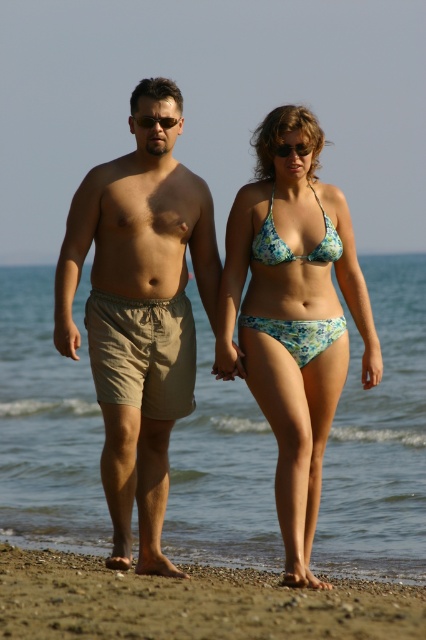
You are a photographer trying to capture a close shot of both the black plastic sunglasses at center and the green plastic sunglasses at center. Your camera has a focus range of 3 feet. Can you capture both in the same photo without moving the camera?

The black plastic sunglasses at center and green plastic sunglasses at center are 3.74 feet apart, which exceeds the camera focus range of 3 feet. Therefore, you cannot capture both in the same photo without moving the camera.

You are a photographer trying to capture both the black plastic sunglasses at center and the green plastic sunglasses at center in a single shot. Which pair of sunglasses will appear closer to you in the photo?

The black plastic sunglasses at center will appear closer to you in the photo because it is positioned further to the viewer than the green plastic sunglasses at center.